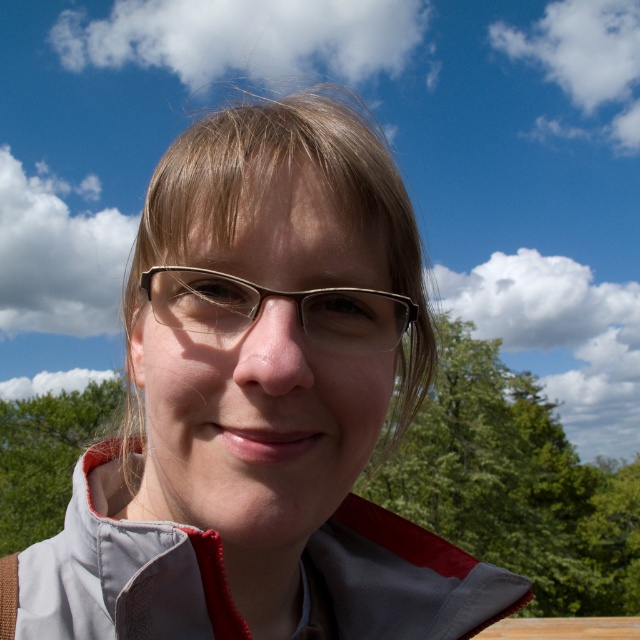
Is metallic gold glasses at center thinner than white fluffy cloud at upper right?

Correct, metallic gold glasses at center's width is less than white fluffy cloud at upper right's.

In the scene shown: Which is below, metallic gold glasses at center or white fluffy cloud at upper right?

Positioned lower is metallic gold glasses at center.

The image size is (640, 640). Describe the element at coordinates (280, 296) in the screenshot. I see `metallic gold glasses at center` at that location.

Locate an element on the screen. This screenshot has height=640, width=640. metallic gold glasses at center is located at coordinates (280, 296).

This screenshot has width=640, height=640. What do you see at coordinates (280, 296) in the screenshot? I see `metallic gold glasses at center` at bounding box center [280, 296].

Is metallic gold glasses at center smaller than green leafy tree at lower left?

Correct, metallic gold glasses at center occupies less space than green leafy tree at lower left.

Who is more forward, [189,280] or [12,506]?

Point [189,280]

I want to click on metallic gold glasses at center, so click(x=280, y=296).

Consider the image. Who is more forward, (164, 8) or (8, 545)?

Point (8, 545) is in front.

Does white fluffy cloud at upper center appear over green leafy tree at lower left?

Yes, white fluffy cloud at upper center is above green leafy tree at lower left.

Identify the location of white fluffy cloud at upper center. This screenshot has height=640, width=640. (246, 36).

Where is `white fluffy cloud at upper center`? The height and width of the screenshot is (640, 640). white fluffy cloud at upper center is located at coordinates (246, 36).